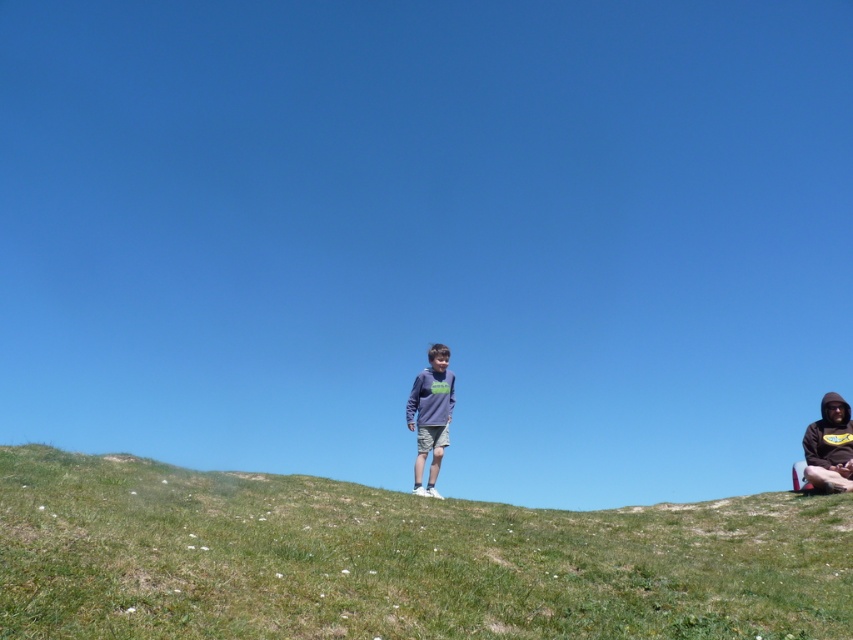
Question: Can you confirm if green grassy hillside at center is wider than dark brown hoodie at lower right?

Choices:
 (A) no
 (B) yes

Answer: (B)

Question: Does gray hoodie at center appear under dark brown hoodie at lower right?

Choices:
 (A) no
 (B) yes

Answer: (A)

Question: Estimate the real-world distances between objects in this image. Which object is closer to the green grassy hillside at center?

Choices:
 (A) gray hoodie at center
 (B) dark brown hoodie at lower right

Answer: (A)

Question: Estimate the real-world distances between objects in this image. Which object is farther from the dark brown hoodie at lower right?

Choices:
 (A) gray hoodie at center
 (B) green grassy hillside at center

Answer: (A)

Question: Which object is the farthest from the green grassy hillside at center?

Choices:
 (A) gray hoodie at center
 (B) dark brown hoodie at lower right

Answer: (B)

Question: Is green grassy hillside at center positioned at the back of gray hoodie at center?

Choices:
 (A) no
 (B) yes

Answer: (A)